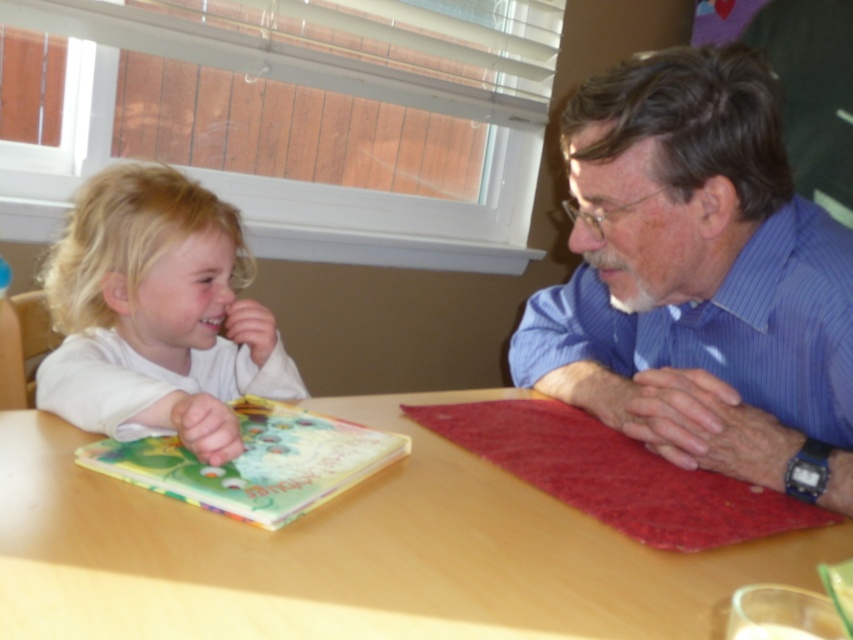
Between white matte hair at left and hardcover book at center, which one appears on the right side from the viewer's perspective?

Positioned to the right is hardcover book at center.

Is point (193, 188) less distant than point (241, 499)?

No, (193, 188) is further to viewer.

The image size is (853, 640). What do you see at coordinates (157, 314) in the screenshot?
I see `white matte hair at left` at bounding box center [157, 314].

Find the location of a particular element. This screenshot has width=853, height=640. white matte hair at left is located at coordinates (157, 314).

Does wooden table at center have a larger size compared to hardcover book at center?

Correct, wooden table at center is larger in size than hardcover book at center.

Is wooden table at center further to camera compared to hardcover book at center?

No, it is in front of hardcover book at center.

Locate an element on the screen. wooden table at center is located at coordinates pyautogui.click(x=352, y=552).

Can you confirm if wooden table at center is thinner than blue striped shirt at upper right?

Incorrect, wooden table at center's width is not less than blue striped shirt at upper right's.

Looking at this image, is wooden table at center wider than blue striped shirt at upper right?

Yes.

Does point (24, 604) come behind point (728, 317)?

No, it is in front of (728, 317).

You are a GUI agent. You are given a task and a screenshot of the screen. Output one action in this format:
    pyautogui.click(x=<x>, y=<y>)
    Task: Click on the wooden table at center
    This screenshot has height=640, width=853.
    Given the screenshot: What is the action you would take?
    (x=352, y=552)